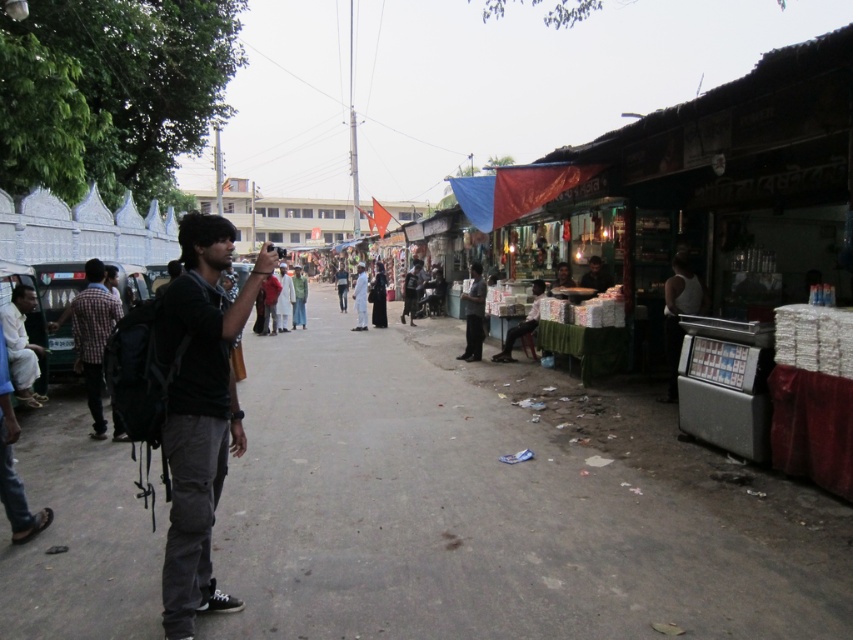
Can you confirm if dark gray asphalt at center is positioned to the left of dark gray pants at center?

Correct, you'll find dark gray asphalt at center to the left of dark gray pants at center.

Can you confirm if dark gray asphalt at center is smaller than dark gray pants at center?

Incorrect, dark gray asphalt at center is not smaller in size than dark gray pants at center.

Who is more distant from viewer, (705, 496) or (477, 291)?

The point (477, 291) is behind.

Where is `dark gray asphalt at center`? This screenshot has height=640, width=853. dark gray asphalt at center is located at coordinates (498, 506).

Between checkered fabric shirt at left and dark gray pants at center, which one appears on the right side from the viewer's perspective?

dark gray pants at center

Which is behind, point (102, 332) or point (482, 326)?

The point (482, 326) is more distant.

Measure the distance between point (91, 362) and camera.

They are 7.50 meters apart.

Locate an element on the screen. The image size is (853, 640). checkered fabric shirt at left is located at coordinates (91, 337).

Consider the image. Which of these two, dark gray asphalt at center or black cotton shirt at center, stands taller?

black cotton shirt at center

Can you confirm if dark gray asphalt at center is bigger than black cotton shirt at center?

Yes.

Is point (264, 365) farther from viewer compared to point (213, 420)?

Yes, point (264, 365) is behind point (213, 420).

Find the location of `dark gray asphalt at center`. dark gray asphalt at center is located at coordinates (498, 506).